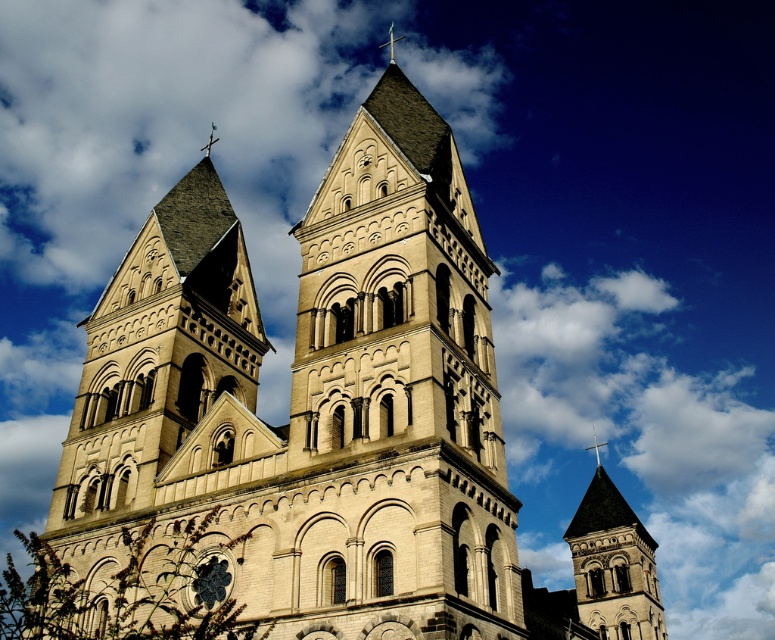
Question: Is smooth gray stone tower at center positioned before smooth silver cross at upper center?

Choices:
 (A) yes
 (B) no

Answer: (A)

Question: Is smooth gray stone tower at center above smooth silver cross at upper center?

Choices:
 (A) no
 (B) yes

Answer: (A)

Question: Does beige stone tower at center have a greater width compared to polished silver cross at upper center?

Choices:
 (A) no
 (B) yes

Answer: (B)

Question: Which point appears farthest from the camera in this image?

Choices:
 (A) (598, 442)
 (B) (388, 35)
 (C) (642, 525)

Answer: (B)

Question: Based on their relative distances, which object is nearer to the beige stone tower at center?

Choices:
 (A) smooth silver cross at upper center
 (B) smooth gray stone tower at center

Answer: (B)

Question: Which of the following is the closest to the observer?

Choices:
 (A) beige stone tower at center
 (B) smooth silver cross at upper center
 (C) smooth gray stone tower at center
 (D) polished silver cross at upper center

Answer: (A)